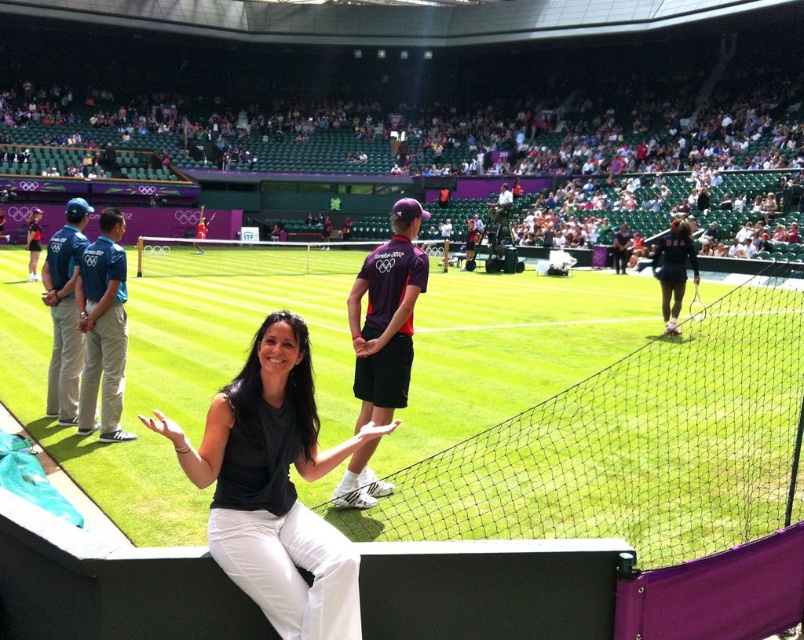
Is black matte shirt at center below dark blue uniform at center?

Yes, black matte shirt at center is below dark blue uniform at center.

Is black matte shirt at center taller than dark blue uniform at center?

No, black matte shirt at center is not taller than dark blue uniform at center.

Image resolution: width=804 pixels, height=640 pixels. What do you see at coordinates (273, 486) in the screenshot?
I see `black matte shirt at center` at bounding box center [273, 486].

Where is `black matte shirt at center`? The image size is (804, 640). black matte shirt at center is located at coordinates (273, 486).

Which of these two, blue fabric uniform at left or dark blue uniform at center, stands shorter?

dark blue uniform at center is shorter.

Can you confirm if blue fabric uniform at left is bigger than dark blue uniform at center?

Correct, blue fabric uniform at left is larger in size than dark blue uniform at center.

Does point (56, 353) come in front of point (692, 264)?

Yes, point (56, 353) is closer to viewer.

Locate an element on the screen. Image resolution: width=804 pixels, height=640 pixels. blue fabric uniform at left is located at coordinates (64, 310).

Is black matte shirt at center thinner than blue fabric uniform at left?

Indeed, black matte shirt at center has a lesser width compared to blue fabric uniform at left.

Which of these two, black matte shirt at center or blue fabric uniform at left, stands shorter?

black matte shirt at center is shorter.

Between point (281, 544) and point (68, 380), which one is positioned behind?

Positioned behind is point (68, 380).

The image size is (804, 640). In order to click on black matte shirt at center in this screenshot , I will do `click(273, 486)`.